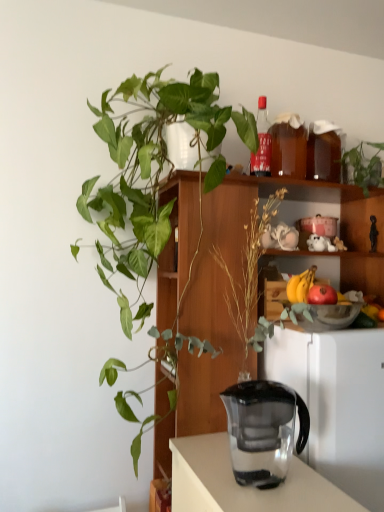
Question: Should I look upward or downward to see green leafy plant at upper right, which ranks as the 1th houseplant in right-to-left order?

Choices:
 (A) up
 (B) down

Answer: (A)

Question: Is transparent plastic jug at center at the back of translucent glass bowl at upper right?

Choices:
 (A) no
 (B) yes

Answer: (A)

Question: From the image's perspective, is translucent glass bowl at upper right below transparent plastic jug at center?

Choices:
 (A) yes
 (B) no

Answer: (B)

Question: Can you confirm if translucent glass bowl at upper right is shorter than transparent plastic jug at center?

Choices:
 (A) no
 (B) yes

Answer: (B)

Question: From a real-world perspective, is translucent glass bowl at upper right on top of transparent plastic jug at center?

Choices:
 (A) no
 (B) yes

Answer: (B)

Question: Can you confirm if translucent glass bowl at upper right is smaller than transparent plastic jug at center?

Choices:
 (A) yes
 (B) no

Answer: (A)

Question: Is translucent glass bowl at upper right at the left side of transparent plastic jug at center?

Choices:
 (A) yes
 (B) no

Answer: (B)

Question: Considering the relative sizes of translucent glass bottle at upper center and red matte apple at upper right in the image provided, is translucent glass bottle at upper center thinner than red matte apple at upper right?

Choices:
 (A) yes
 (B) no

Answer: (B)

Question: Is translucent glass bottle at upper center facing away from red matte apple at upper right?

Choices:
 (A) yes
 (B) no

Answer: (B)

Question: Is translucent glass bottle at upper center smaller than red matte apple at upper right?

Choices:
 (A) yes
 (B) no

Answer: (B)

Question: Can we say translucent glass bottle at upper center lies outside red matte apple at upper right?

Choices:
 (A) yes
 (B) no

Answer: (A)

Question: From a real-world perspective, is translucent glass bottle at upper center located higher than red matte apple at upper right?

Choices:
 (A) no
 (B) yes

Answer: (B)

Question: From the image's perspective, is translucent glass bottle at upper center on red matte apple at upper right?

Choices:
 (A) yes
 (B) no

Answer: (A)

Question: Is green leafy plant at upper right, which ranks as the 2th houseplant in left-to-right order, not inside transparent plastic jug at center?

Choices:
 (A) no
 (B) yes

Answer: (B)